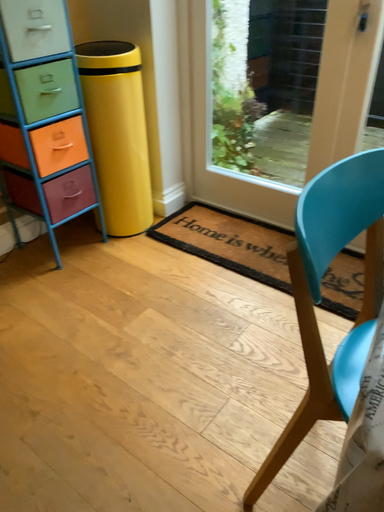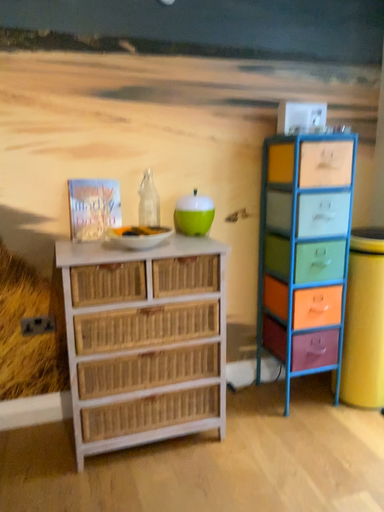
Question: How did the camera likely rotate when shooting the video?

Choices:
 (A) rotated upward
 (B) rotated downward

Answer: (A)